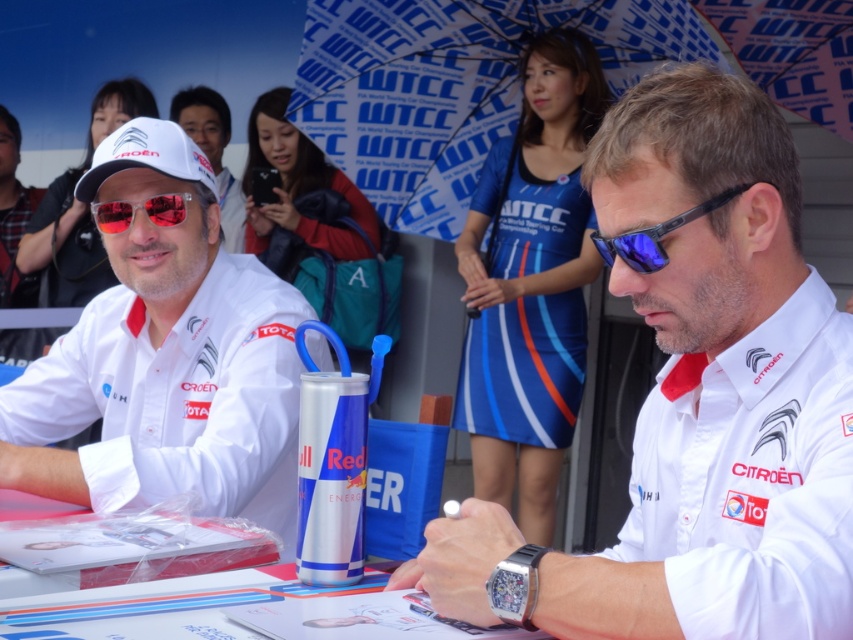
You are a photographer at the WTCC event. You need to capture a photo where the blue fabric dress at upper center and the blue reflective lens sunglasses at center are both visible. Which object should you frame wider in your camera to ensure it fits properly?

The blue fabric dress at upper center should be framed wider because its width surpasses that of the blue reflective lens sunglasses at center.

You are a photographer at the WTCC event. You need to capture a photo that includes both the matte white shirt at left and the blue fabric dress at upper center. Which object should you focus on first to ensure both are in frame?

The matte white shirt at left occupies less space than the blue fabric dress at upper center, so you should focus on the blue fabric dress at upper center first to ensure both are in frame.